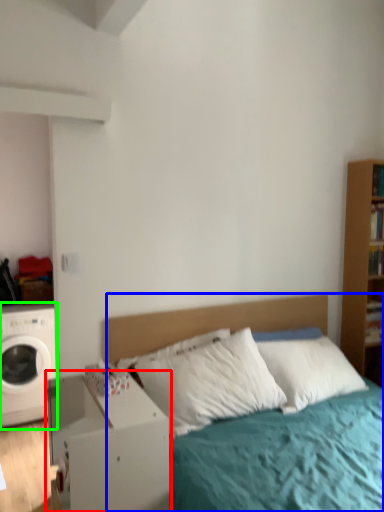
Question: Which object is the farthest from nightstand (highlighted by a red box)? Choose among these: bed (highlighted by a blue box) or washing machine (highlighted by a green box).

Choices:
 (A) bed
 (B) washing machine

Answer: (B)